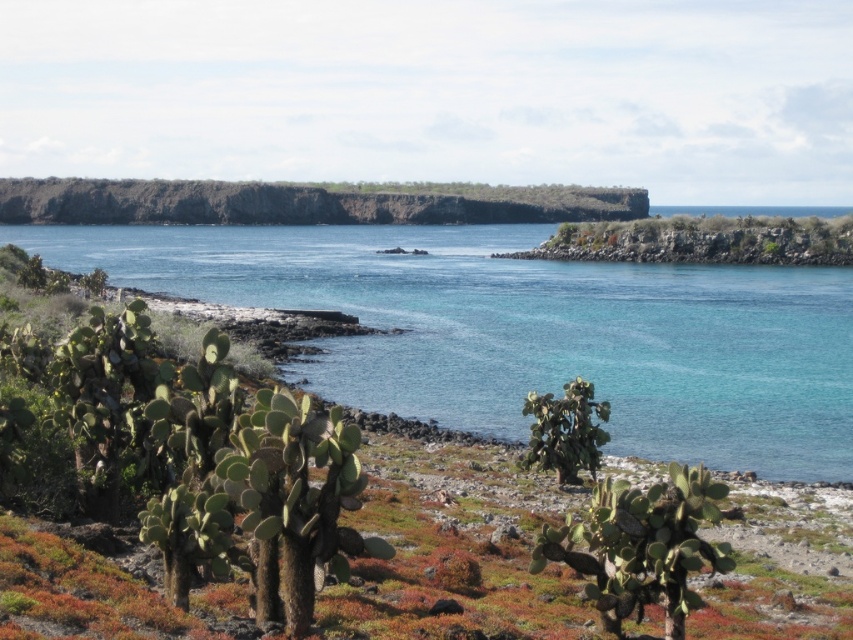
You are a hiker who wants to cross from the rocky shoreline to the cacti area. The clear blue water at lower left and the green spiny cactus at center are in your path. Which one is wider to walk around?

The clear blue water at lower left is wider than the green spiny cactus at center, so you should walk around the clear blue water at lower left first since it has a larger width.

You are standing at the center of the image and want to walk towards the clear blue water at lower left. Based on the coordinates provided, in which direction should you head?

The clear blue water at lower left is located at coordinates point (529, 332). Since you are at the center, you should head towards the lower left direction to reach it.

You are standing at the edge of the coastal landscape and want to determine which object is taller between the clear blue water at lower left and the green spiny cactus at center. Based on the scene, which one is taller?

The clear blue water at lower left is taller than the green spiny cactus at center.